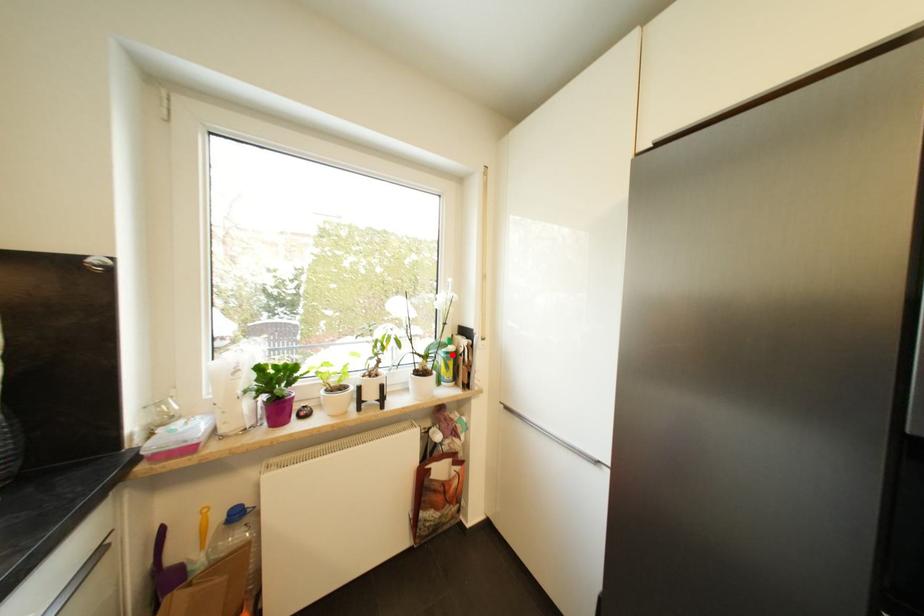
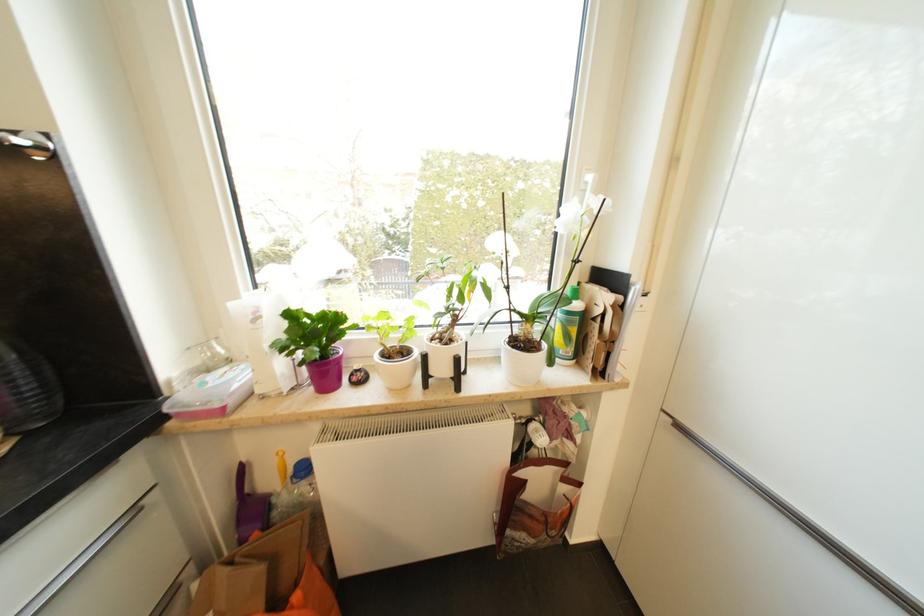
Find the pixel in the second image that matches the highlighted location in the first image.

(574, 315)